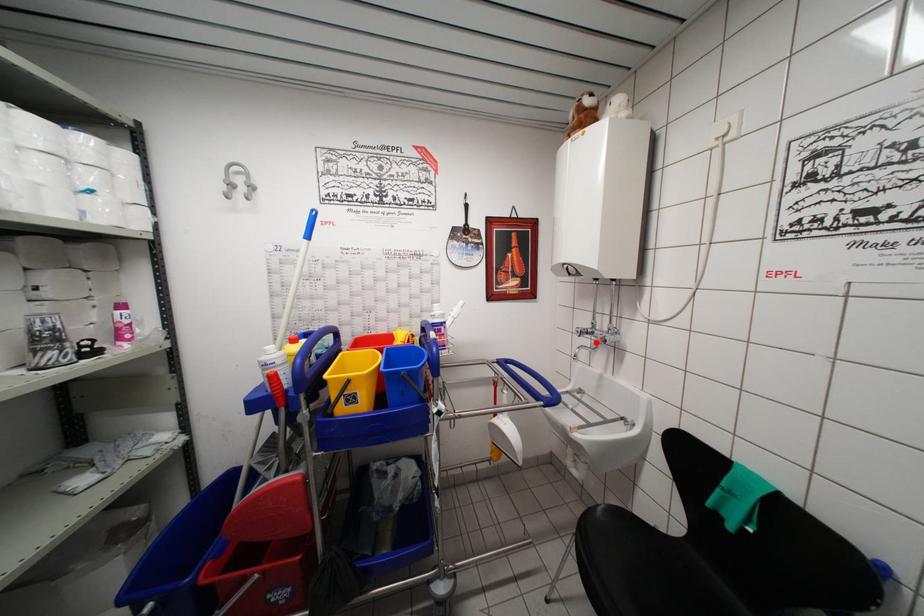
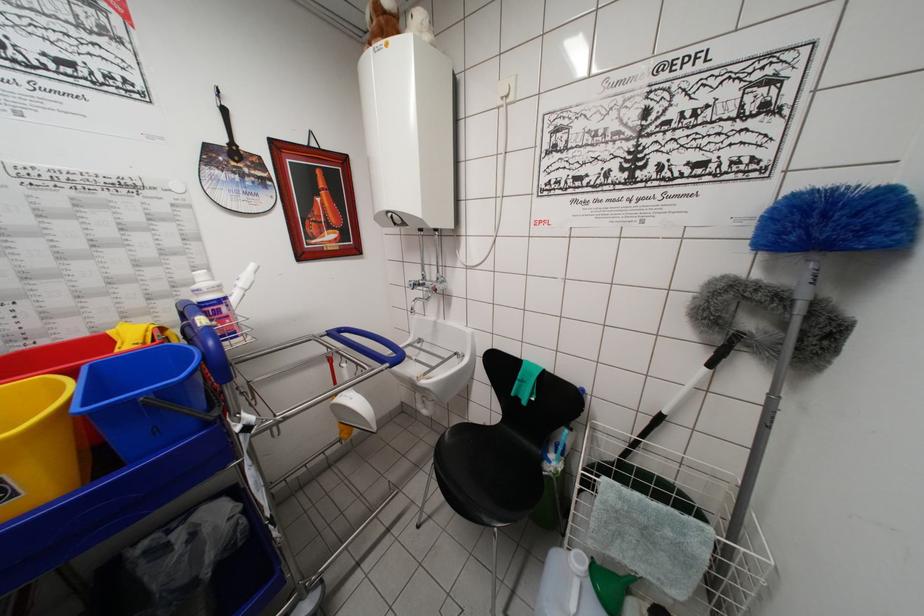
Where in the second image is the point corresponding to the highlighted location from the first image?

(428, 294)